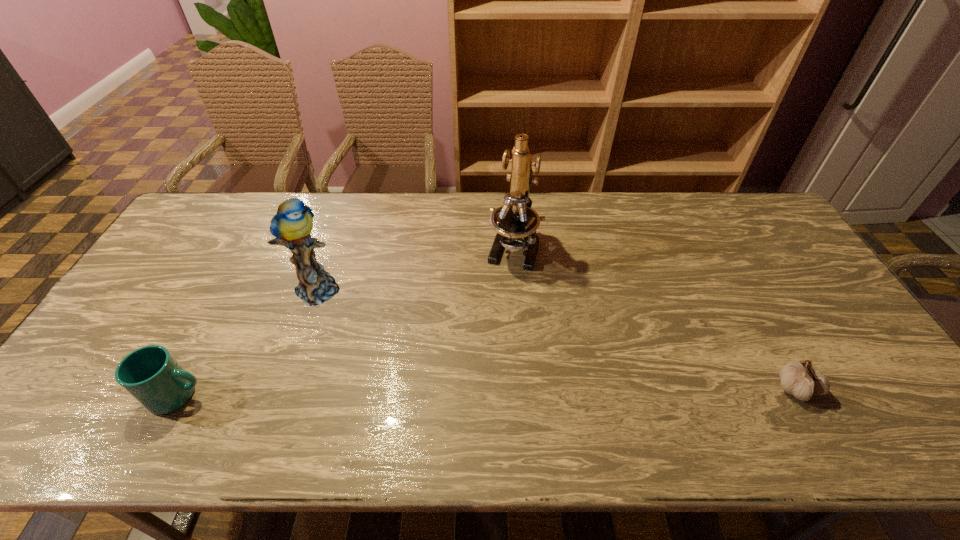
This screenshot has width=960, height=540. I want to click on vacant space on the desktop that is between the cup and the rightmost object and is positioned at the eyepiece of the microscope, so click(x=468, y=392).

At what (x,y) coordinates should I click in order to perform the action: click on vacant space on the desktop that is between the cup and the rightmost object and is positioned on the face of the parrot. Please return your answer as a coordinate pair (x, y). This screenshot has width=960, height=540. Looking at the image, I should click on (494, 392).